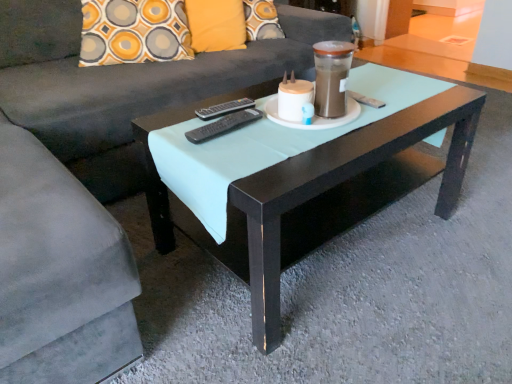
Where is `free space to the back side of black plastic remote at center, which is counted as the second remote, starting from the back`? Image resolution: width=512 pixels, height=384 pixels. free space to the back side of black plastic remote at center, which is counted as the second remote, starting from the back is located at coordinates (229, 110).